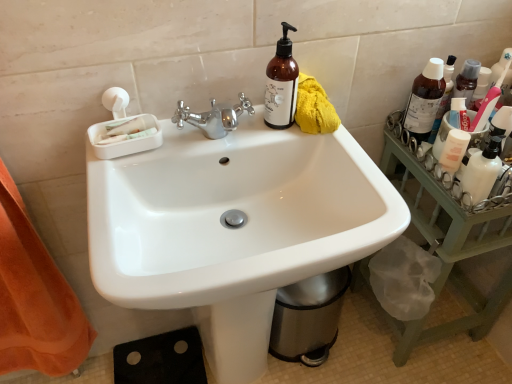
Locate an element on the screen. green wood tray at right is located at coordinates (448, 249).

Is white glossy lotion at right beside green wood tray at right?

No, white glossy lotion at right is not in contact with green wood tray at right.

Looking at this image, which is more to the right, white glossy lotion at right or green wood tray at right?

Positioned to the right is green wood tray at right.

Is point (479, 198) closer or farther from the camera than point (418, 166)?

Point (479, 198).

Is white glossy lotion at right positioned in front of green wood tray at right?

That is True.

Is the surface of brown glass bottle at upper right, arranged as the first bottle when viewed from the left, in direct contact with white glossy mouthwash at right?

No, brown glass bottle at upper right, arranged as the first bottle when viewed from the left, is not making contact with white glossy mouthwash at right.

The height and width of the screenshot is (384, 512). I want to click on mouthwash behind the brown glass bottle at upper right, positioned as the third bottle in right-to-left order, so click(x=454, y=150).

Can you tell me how much brown glass bottle at upper right, positioned as the third bottle in right-to-left order, and white glossy mouthwash at right differ in facing direction?

The angular difference between brown glass bottle at upper right, positioned as the third bottle in right-to-left order, and white glossy mouthwash at right is 93.9 degrees.

Is point (286, 56) positioned behind point (449, 157)?

No, (286, 56) is closer to viewer.

Considering the relative positions of white glossy lotion at right and white glossy mouthwash at right in the image provided, is white glossy lotion at right in front of white glossy mouthwash at right?

Yes, it is in front of white glossy mouthwash at right.

Would you say white glossy lotion at right is a long distance from white glossy mouthwash at right?

No.

Where is `toiletry that appears above the white glossy mouthwash at right (from a real-world perspective)`? The image size is (512, 384). toiletry that appears above the white glossy mouthwash at right (from a real-world perspective) is located at coordinates coord(482,172).

Is white glossy mouthwash at right inside white glossy lotion at right?

Actually, white glossy mouthwash at right is outside white glossy lotion at right.

Which of these two, brown glass bottle at upper right, arranged as the first bottle when viewed from the left, or green wood tray at right, stands shorter?

brown glass bottle at upper right, arranged as the first bottle when viewed from the left.

Considering the sizes of objects brown glass bottle at upper right, positioned as the third bottle in right-to-left order, and green wood tray at right in the image provided, who is bigger, brown glass bottle at upper right, positioned as the third bottle in right-to-left order, or green wood tray at right?

green wood tray at right.

From a real-world perspective, is brown glass bottle at upper right, positioned as the third bottle in right-to-left order, beneath green wood tray at right?

Actually, brown glass bottle at upper right, positioned as the third bottle in right-to-left order, is physically above green wood tray at right in the real world.

Which object is more forward, green wood tray at right or brown glass bottle at upper right, positioned as the third bottle in right-to-left order?

brown glass bottle at upper right, positioned as the third bottle in right-to-left order, is closer to the camera.

In the image, is green wood tray at right on the left side or the right side of brown glass bottle at upper right, positioned as the third bottle in right-to-left order?

From the image, it's evident that green wood tray at right is to the right of brown glass bottle at upper right, positioned as the third bottle in right-to-left order.

Is green wood tray at right positioned far away from brown glass bottle at upper right, arranged as the first bottle when viewed from the left?

Actually, green wood tray at right and brown glass bottle at upper right, arranged as the first bottle when viewed from the left, are a little close together.

Who is shorter, green wood tray at right or brown glass bottle at upper right, positioned as the third bottle in right-to-left order?

With less height is brown glass bottle at upper right, positioned as the third bottle in right-to-left order.

Considering the positions of objects white glossy lotion at right and transparent plastic bottle at upper right, acting as the second bottle starting from the left, in the image provided, who is in front, white glossy lotion at right or transparent plastic bottle at upper right, acting as the second bottle starting from the left,?

Positioned in front is white glossy lotion at right.

Is white glossy lotion at right thinner than transparent plastic bottle at upper right, which is the second bottle from right to left?

Correct, the width of white glossy lotion at right is less than that of transparent plastic bottle at upper right, which is the second bottle from right to left.

From the image's perspective, which is below, white glossy lotion at right or transparent plastic bottle at upper right, which is the second bottle from right to left?

From the image's view, white glossy lotion at right is below.

Who is smaller, brown glass bottle at upper right, arranged as the first bottle when viewed from the left, or translucent plastic bottle at upper right, acting as the 1th bottle starting from the right?

Smaller between the two is translucent plastic bottle at upper right, acting as the 1th bottle starting from the right.

Between point (274, 120) and point (451, 59), which one is positioned behind?

Point (451, 59)

Are brown glass bottle at upper right, arranged as the first bottle when viewed from the left, and translucent plastic bottle at upper right, acting as the 1th bottle starting from the right, located far from each other?

No.

In the scene shown: Considering the sizes of objects brown glass bottle at upper right, positioned as the third bottle in right-to-left order, and translucent plastic bottle at upper right, acting as the 1th bottle starting from the right, in the image provided, who is thinner, brown glass bottle at upper right, positioned as the third bottle in right-to-left order, or translucent plastic bottle at upper right, acting as the 1th bottle starting from the right,?

Thinner between the two is translucent plastic bottle at upper right, acting as the 1th bottle starting from the right.

Identify the location of toiletry lying in front of the green wood tray at right. coord(482,172).

Locate an element on the screen. This screenshot has height=384, width=512. mouthwash behind the brown glass bottle at upper right, positioned as the third bottle in right-to-left order is located at coordinates (454, 150).

When comparing their distances from white glossy sink at center, does translucent plastic bottle at upper right, which is the 3th bottle from left to right, or green wood tray at right seem further?

Among the two, translucent plastic bottle at upper right, which is the 3th bottle from left to right, is located further to white glossy sink at center.

Looking at the image, which one is located further to translucent plastic bottle at upper right, acting as the 1th bottle starting from the right, white glossy mouthwash at right or white glossy lotion at right?

white glossy lotion at right lies further to translucent plastic bottle at upper right, acting as the 1th bottle starting from the right, than the other object.

When comparing their distances from white glossy sink at center, does translucent plastic bottle at upper right, which is the 3th bottle from left to right, or white glossy lotion at right seem closer?

white glossy lotion at right is positioned closer to the anchor white glossy sink at center.

Estimate the real-world distances between objects in this image. Which object is further from brown glass bottle at upper right, positioned as the third bottle in right-to-left order, green wood tray at right or white glossy lotion at right?

green wood tray at right is further to brown glass bottle at upper right, positioned as the third bottle in right-to-left order.

Considering their positions, is brown glass bottle at upper right, positioned as the third bottle in right-to-left order, positioned closer to translucent plastic bottle at upper right, acting as the 1th bottle starting from the right, than white glossy sink at center?

brown glass bottle at upper right, positioned as the third bottle in right-to-left order, is positioned closer to the anchor translucent plastic bottle at upper right, acting as the 1th bottle starting from the right.

From the picture: Considering their positions, is transparent plastic bottle at upper right, which is the second bottle from right to left, positioned further to white glossy sink at center than white glossy mouthwash at right?

Among the two, transparent plastic bottle at upper right, which is the second bottle from right to left, is located further to white glossy sink at center.

When comparing their distances from white glossy mouthwash at right, does green wood tray at right or white glossy sink at center seem closer?

Among the two, green wood tray at right is located nearer to white glossy mouthwash at right.

Based on their spatial positions, is white glossy sink at center or translucent plastic bottle at upper right, acting as the 1th bottle starting from the right, closer to green wood tray at right?

translucent plastic bottle at upper right, acting as the 1th bottle starting from the right.

Where is `bottle between brown glass bottle at upper right, arranged as the first bottle when viewed from the left, and translucent plastic bottle at upper right, which is the 3th bottle from left to right, in the horizontal direction`? bottle between brown glass bottle at upper right, arranged as the first bottle when viewed from the left, and translucent plastic bottle at upper right, which is the 3th bottle from left to right, in the horizontal direction is located at coordinates (424, 100).

The width and height of the screenshot is (512, 384). Identify the location of mouthwash situated between brown glass bottle at upper right, arranged as the first bottle when viewed from the left, and translucent plastic bottle at upper right, which is the 3th bottle from left to right, from left to right. (454, 150).

The image size is (512, 384). I want to click on toiletry between white glossy mouthwash at right and green wood tray at right in the up-down direction, so click(x=482, y=172).

Find the location of a particular element. The image size is (512, 384). mouthwash between translucent plastic bottle at upper right, acting as the 1th bottle starting from the right, and white glossy lotion at right in the up-down direction is located at coordinates (454, 150).